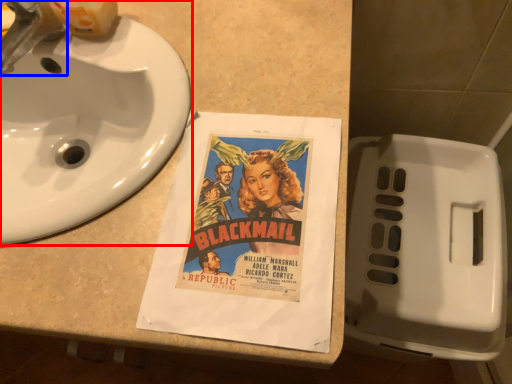
Question: Which of the following is the closest to the observer, sink (highlighted by a red box) or faucet (highlighted by a blue box)?

Choices:
 (A) sink
 (B) faucet

Answer: (A)